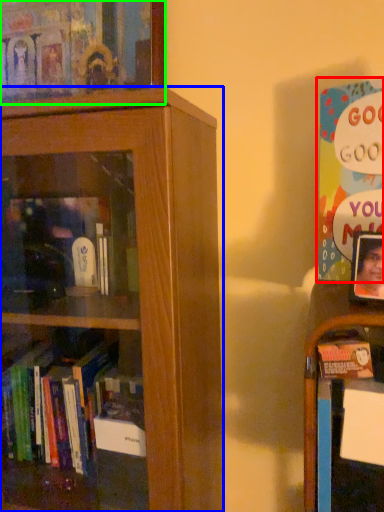
Question: Considering the real-world distances, which object is closest to book (highlighted by a red box)? bookcase (highlighted by a blue box) or book (highlighted by a green box).

Choices:
 (A) bookcase
 (B) book

Answer: (A)